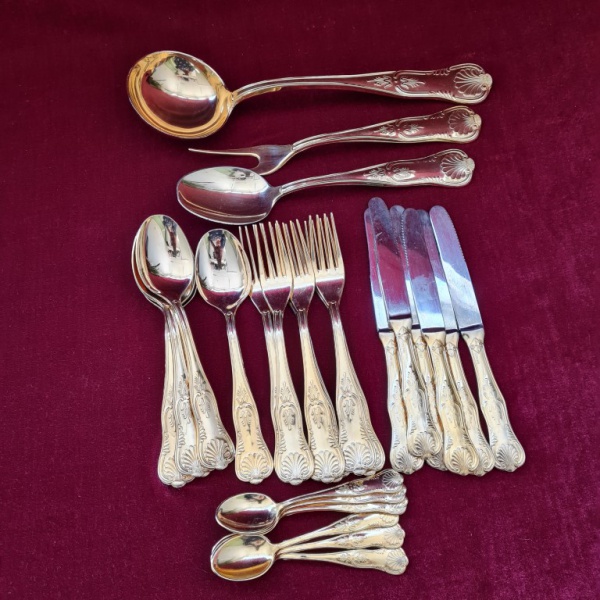
Locate an element on the screen. The height and width of the screenshot is (600, 600). bowl of the spoons is located at coordinates (247, 556), (255, 508), (165, 254), (216, 274), (220, 192), (178, 86).